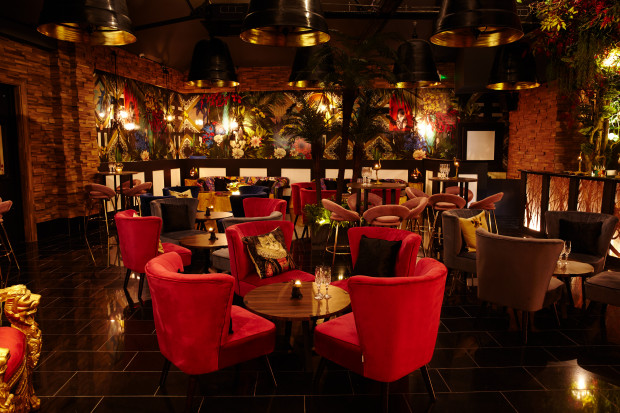
Locate an element on the screen. The width and height of the screenshot is (620, 413). stacked stone interior wall is located at coordinates (56, 125), (541, 137).